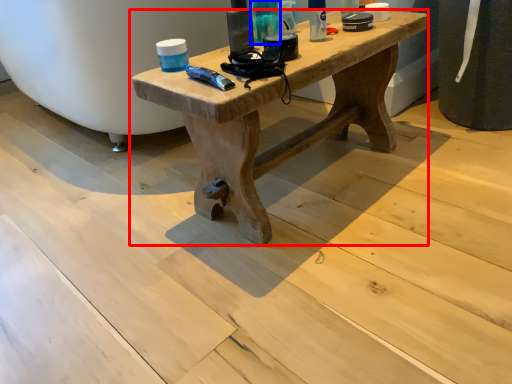
Question: Which point is closer to the camera, table (highlighted by a red box) or toiletry (highlighted by a blue box)?

Choices:
 (A) table
 (B) toiletry

Answer: (A)